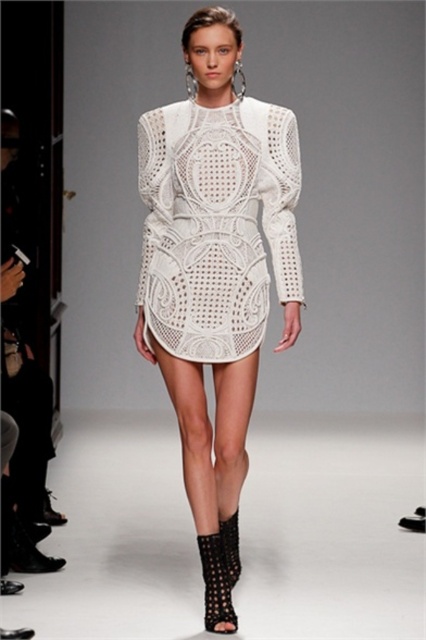
You are a photographer at a fashion show. You need to capture a shot where the white lace dress at center is framed above the black mesh boot at lower center. Based on their positions in the image, will this framing be possible?

Yes, the framing is possible because the white lace dress at center has a greater height compared to the black mesh boot at lower center, allowing it to naturally frame above the boot.

You are a photographer positioned at the back of the runway. You need to capture a closeup shot of the white lace dress at center and the black textured boot at lower center. Since the camera lens can only focus on one object at a time, which object should you prioritize to ensure it fills the frame more due to its size?

The white lace dress at center should be prioritized because its width surpasses that of the black textured boot at lower center, making it larger and thus better suited to fill the frame.

You are a photographer at a fashion show and need to capture both the white textured dress at center and the white lace dress at center in a single frame. Since the camera can only focus on one subject at a time, which dress should you focus on to ensure the other is still visible in the background?

You should focus on the white lace dress at center because the white textured dress at center is to the left of it, so keeping the lace dress in focus will allow the textured dress to remain visible in the background.